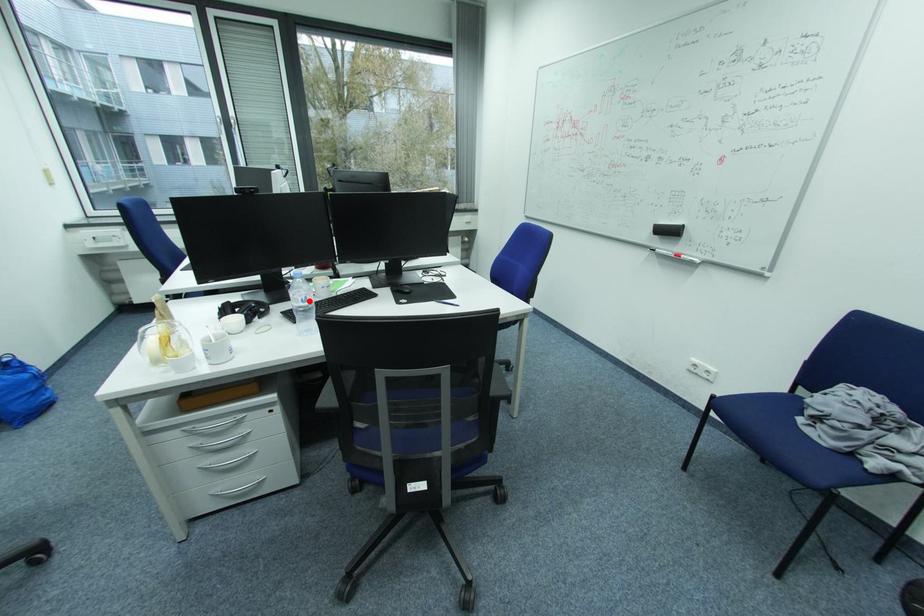
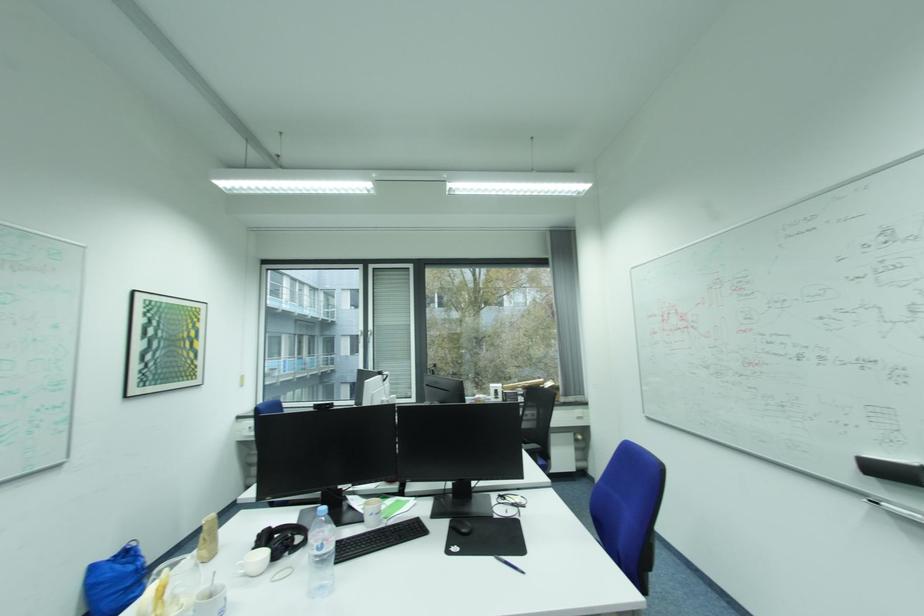
The point at the highlighted location is marked in the first image. Where is the corresponding point in the second image?

(323, 549)